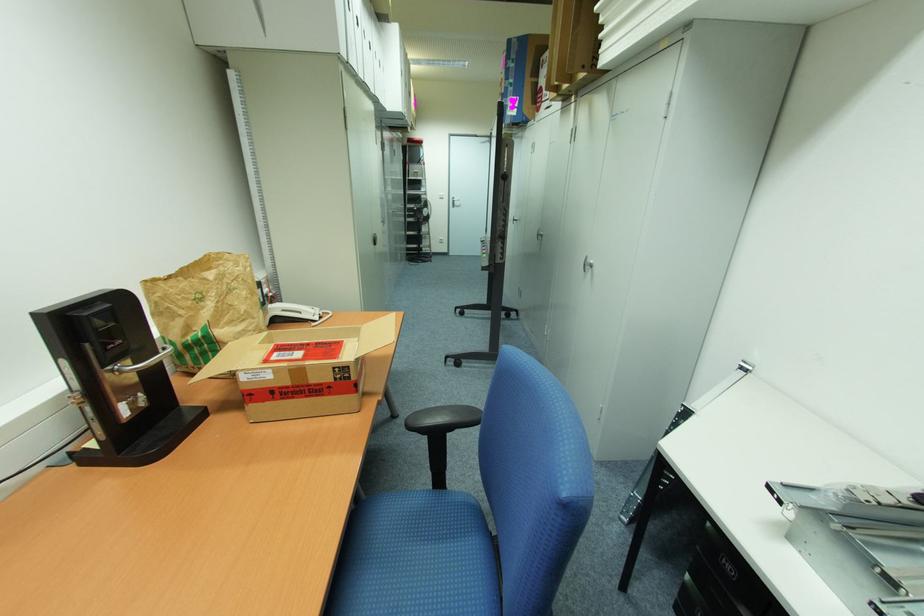
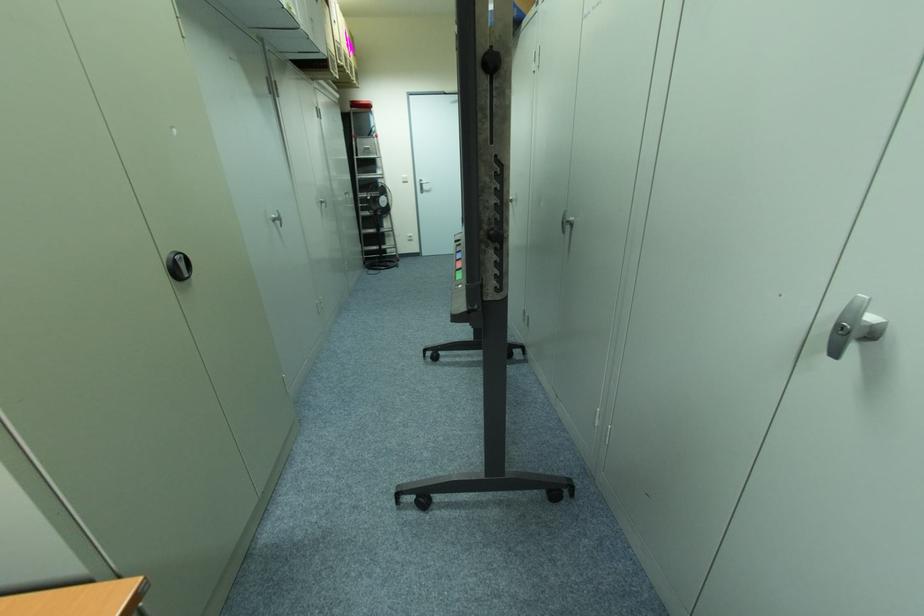
Question: In a continuous first-person perspective shot, in which direction is the camera moving?

Choices:
 (A) Left
 (B) Right
 (C) Forward
 (D) Backward

Answer: (C)